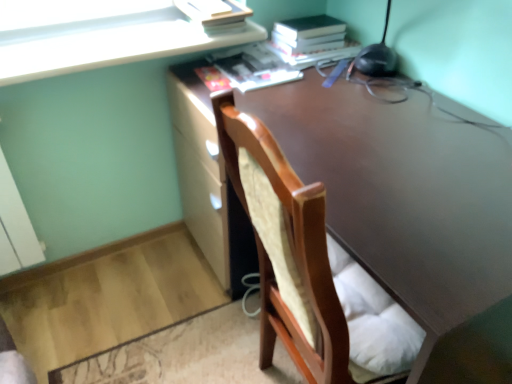
Image resolution: width=512 pixels, height=384 pixels. What do you see at coordinates (304, 267) in the screenshot?
I see `wooden chair at center` at bounding box center [304, 267].

This screenshot has width=512, height=384. What do you see at coordinates (103, 35) in the screenshot?
I see `white glossy cabinet at upper left` at bounding box center [103, 35].

Locate an element on the screen. Image resolution: width=512 pixels, height=384 pixels. matte yellow paperback book at upper center, which ranks as the 2th paperback book in right-to-left order is located at coordinates (213, 14).

The height and width of the screenshot is (384, 512). What do you see at coordinates (254, 67) in the screenshot? I see `matte paper book at upper center` at bounding box center [254, 67].

The image size is (512, 384). What are the coordinates of `wooden chair at center` in the screenshot? It's located at (304, 267).

Is the depth of matte yellow paperback book at upper center, which is the first paperback book from left to right, less than that of matte paper book at upper center?

No, it is behind matte paper book at upper center.

From a real-world perspective, is matte yellow paperback book at upper center, which is the first paperback book from left to right, positioned over matte paper book at upper center based on gravity?

Yes, from a real-world perspective, matte yellow paperback book at upper center, which is the first paperback book from left to right, is on top of matte paper book at upper center.

Is matte yellow paperback book at upper center, which is the first paperback book from left to right, far from matte paper book at upper center?

No, matte yellow paperback book at upper center, which is the first paperback book from left to right, is not far from matte paper book at upper center.

Is matte paper book at upper center inside matte yellow paperback book at upper center, which ranks as the 2th paperback book in right-to-left order?

No, matte yellow paperback book at upper center, which ranks as the 2th paperback book in right-to-left order, does not contain matte paper book at upper center.

Can you tell me how much white glossy cabinet at upper left and hardcover book at upper right, which is the first paperback book in right-to-left order, differ in facing direction?

89.2 degrees separate the facing orientations of white glossy cabinet at upper left and hardcover book at upper right, which is the first paperback book in right-to-left order.

Between white glossy cabinet at upper left and hardcover book at upper right, which is the first paperback book in right-to-left order, which one has larger size?

With larger size is hardcover book at upper right, which is the first paperback book in right-to-left order.

Is white glossy cabinet at upper left not within hardcover book at upper right, which is the first paperback book in right-to-left order?

Yes, white glossy cabinet at upper left is outside of hardcover book at upper right, which is the first paperback book in right-to-left order.

Considering the sizes of objects white glossy cabinet at upper left and hardcover book at upper right, marked as the second paperback book in a left-to-right arrangement, in the image provided, who is wider, white glossy cabinet at upper left or hardcover book at upper right, marked as the second paperback book in a left-to-right arrangement,?

Wider between the two is hardcover book at upper right, marked as the second paperback book in a left-to-right arrangement.

I want to click on chair lying below the matte paper book at upper center (from the image's perspective), so click(x=304, y=267).

Is matte paper book at upper center smaller than wooden chair at center?

Indeed, matte paper book at upper center has a smaller size compared to wooden chair at center.

Does matte paper book at upper center come behind wooden chair at center?

Yes, matte paper book at upper center is further from the camera.

Consider the image. Which is more to the right, matte paper book at upper center or wooden chair at center?

wooden chair at center is more to the right.

Between point (284, 60) and point (191, 19), which one is positioned in front?

Point (191, 19)

From the image's perspective, who appears lower, hardcover book at upper right, marked as the second paperback book in a left-to-right arrangement, or matte yellow paperback book at upper center, which is the first paperback book from left to right?

From the image's view, hardcover book at upper right, marked as the second paperback book in a left-to-right arrangement, is below.

Looking at this image, looking at their sizes, would you say hardcover book at upper right, which is the first paperback book in right-to-left order, is wider or thinner than matte yellow paperback book at upper center, which is the first paperback book from left to right?

In the image, hardcover book at upper right, which is the first paperback book in right-to-left order, appears to be wider than matte yellow paperback book at upper center, which is the first paperback book from left to right.

Is hardcover book at upper right, marked as the second paperback book in a left-to-right arrangement, oriented away from matte yellow paperback book at upper center, which is the first paperback book from left to right?

No, hardcover book at upper right, marked as the second paperback book in a left-to-right arrangement, is not facing away from matte yellow paperback book at upper center, which is the first paperback book from left to right.

Is wooden chair at center oriented away from white glossy cabinet at upper left?

No, wooden chair at center's orientation is not away from white glossy cabinet at upper left.

Does wooden chair at center have a lesser height compared to white glossy cabinet at upper left?

Incorrect, the height of wooden chair at center does not fall short of that of white glossy cabinet at upper left.

Considering the points (379, 328) and (20, 58), which point is in front, point (379, 328) or point (20, 58)?

Point (379, 328)

Which object is positioned more to the left, white glossy cabinet at upper left or matte yellow paperback book at upper center, which ranks as the 2th paperback book in right-to-left order?

white glossy cabinet at upper left.

Is point (68, 48) positioned behind point (230, 14)?

No, it is not.

Is white glossy cabinet at upper left closer to camera compared to matte yellow paperback book at upper center, which ranks as the 2th paperback book in right-to-left order?

Yes, it is.

Is white glossy cabinet at upper left completely or partially outside of matte yellow paperback book at upper center, which is the first paperback book from left to right?

Yes, white glossy cabinet at upper left is outside of matte yellow paperback book at upper center, which is the first paperback book from left to right.

Which of these two, matte paper book at upper center or white glossy cabinet at upper left, is thinner?

matte paper book at upper center.

From the image's perspective, would you say matte paper book at upper center is positioned over white glossy cabinet at upper left?

Incorrect, from the image's perspective, matte paper book at upper center is lower than white glossy cabinet at upper left.

Does matte paper book at upper center come behind white glossy cabinet at upper left?

Yes.

Is matte paper book at upper center in contact with white glossy cabinet at upper left?

matte paper book at upper center and white glossy cabinet at upper left are not in contact.

Where is `paperback book to the left of matte paper book at upper center`? paperback book to the left of matte paper book at upper center is located at coordinates [x=213, y=14].

Find the location of a particular element. This screenshot has height=384, width=512. the 2nd paperback book to the right of the white glossy cabinet at upper left, starting your count from the anchor is located at coordinates (312, 40).

Based on their spatial positions, is matte paper book at upper center or wooden chair at center further from white glossy cabinet at upper left?

wooden chair at center.

Estimate the real-world distances between objects in this image. Which object is further from matte paper book at upper center, wooden chair at center or white glossy cabinet at upper left?

wooden chair at center.

From the picture: Estimate the real-world distances between objects in this image. Which object is closer to matte yellow paperback book at upper center, which is the first paperback book from left to right, hardcover book at upper right, marked as the second paperback book in a left-to-right arrangement, or matte paper book at upper center?

matte paper book at upper center lies closer to matte yellow paperback book at upper center, which is the first paperback book from left to right, than the other object.

From the image, which object appears to be farther from hardcover book at upper right, marked as the second paperback book in a left-to-right arrangement, white glossy cabinet at upper left or matte yellow paperback book at upper center, which is the first paperback book from left to right?

Among the two, white glossy cabinet at upper left is located further to hardcover book at upper right, marked as the second paperback book in a left-to-right arrangement.

Which object lies further to the anchor point hardcover book at upper right, marked as the second paperback book in a left-to-right arrangement, white glossy cabinet at upper left or matte paper book at upper center?

The object further to hardcover book at upper right, marked as the second paperback book in a left-to-right arrangement, is white glossy cabinet at upper left.

Looking at the image, which one is located further to white glossy cabinet at upper left, hardcover book at upper right, marked as the second paperback book in a left-to-right arrangement, or matte yellow paperback book at upper center, which is the first paperback book from left to right?

The object further to white glossy cabinet at upper left is hardcover book at upper right, marked as the second paperback book in a left-to-right arrangement.

From the picture: Based on their spatial positions, is wooden chair at center or hardcover book at upper right, which is the first paperback book in right-to-left order, further from matte paper book at upper center?

wooden chair at center lies further to matte paper book at upper center than the other object.

Based on their spatial positions, is matte paper book at upper center or matte yellow paperback book at upper center, which is the first paperback book from left to right, further from hardcover book at upper right, marked as the second paperback book in a left-to-right arrangement?

matte yellow paperback book at upper center, which is the first paperback book from left to right, is further to hardcover book at upper right, marked as the second paperback book in a left-to-right arrangement.

Locate an element on the screen. This screenshot has width=512, height=384. paperback book located between white glossy cabinet at upper left and hardcover book at upper right, marked as the second paperback book in a left-to-right arrangement, in the left-right direction is located at coordinates (213, 14).

You are a GUI agent. You are given a task and a screenshot of the screen. Output one action in this format:
    pyautogui.click(x=<x>, y=<y>)
    Task: Click on the book that lies between white glossy cabinet at upper left and wooden chair at center from top to bottom
    The width and height of the screenshot is (512, 384).
    Given the screenshot: What is the action you would take?
    pyautogui.click(x=254, y=67)

I want to click on book between wooden chair at center and hardcover book at upper right, marked as the second paperback book in a left-to-right arrangement, in the front-back direction, so click(x=254, y=67).

This screenshot has width=512, height=384. In order to click on cabinetry between matte yellow paperback book at upper center, which is the first paperback book from left to right, and wooden chair at center vertically in this screenshot , I will do `click(103, 35)`.